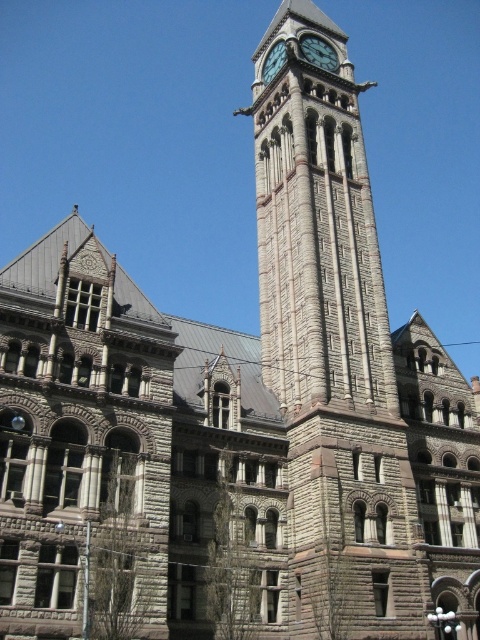
Who is higher up, stone clock tower at center or greenish-gray stone clock at upper center?

Positioned higher is stone clock tower at center.

Describe the element at coordinates (331, 348) in the screenshot. I see `stone clock tower at center` at that location.

This screenshot has height=640, width=480. In order to click on stone clock tower at center in this screenshot , I will do `click(331, 348)`.

Can you confirm if greenish-gray stone clock at upper center is bigger than brick clock tower at upper center?

Actually, greenish-gray stone clock at upper center might be smaller than brick clock tower at upper center.

Is point (302, 52) positioned after point (279, 52)?

No, (302, 52) is in front of (279, 52).

Find the location of a particular element. The image size is (480, 640). greenish-gray stone clock at upper center is located at coordinates (319, 52).

Does stone clock tower at center have a larger size compared to brick clock tower at upper center?

Correct, stone clock tower at center is larger in size than brick clock tower at upper center.

Which is more to the left, stone clock tower at center or brick clock tower at upper center?

stone clock tower at center

What do you see at coordinates (331, 348) in the screenshot?
I see `stone clock tower at center` at bounding box center [331, 348].

Identify the location of stone clock tower at center. (331, 348).